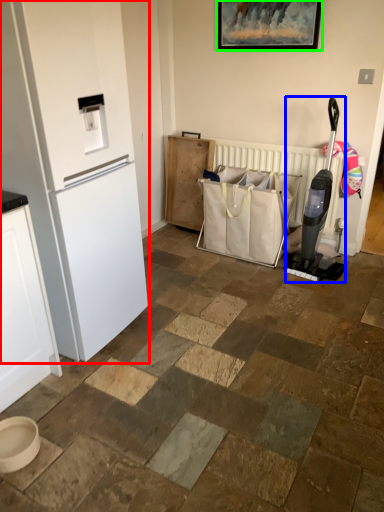
Question: Considering the real-world distances, which object is farthest from refrigerator (highlighted by a red box)? appliance (highlighted by a blue box) or picture frame (highlighted by a green box)?

Choices:
 (A) appliance
 (B) picture frame

Answer: (B)